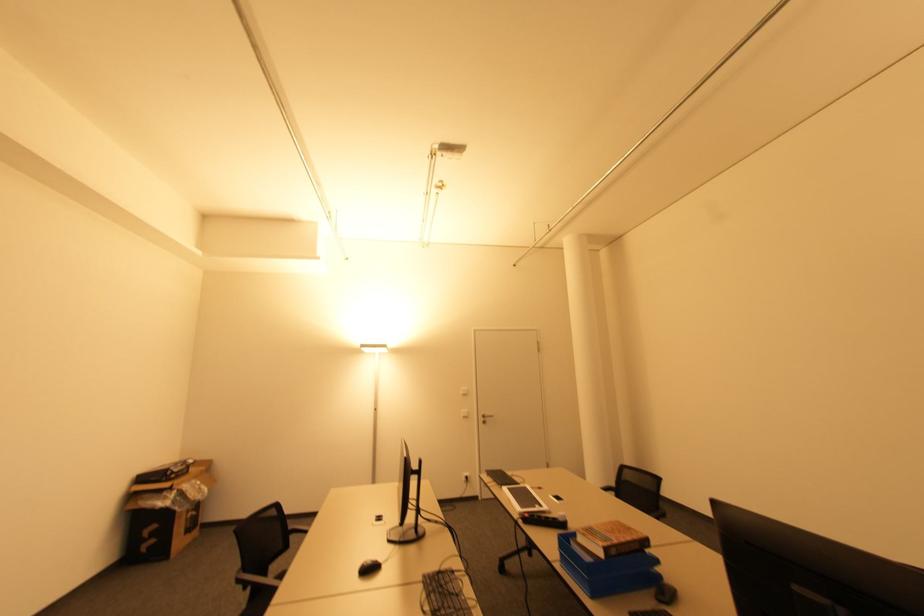
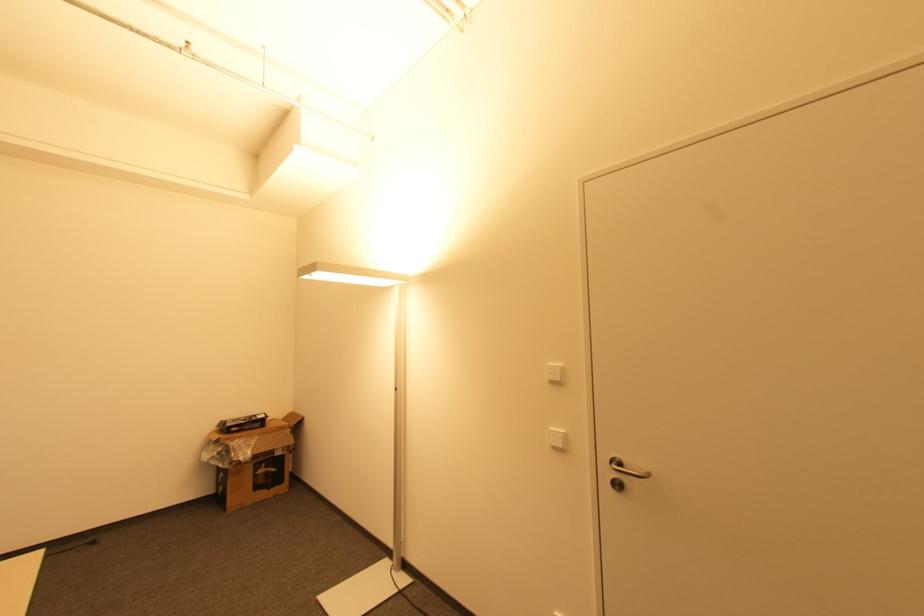
Where in the second image is the point corresponding to pixel 467 416 from the first image?

(557, 448)